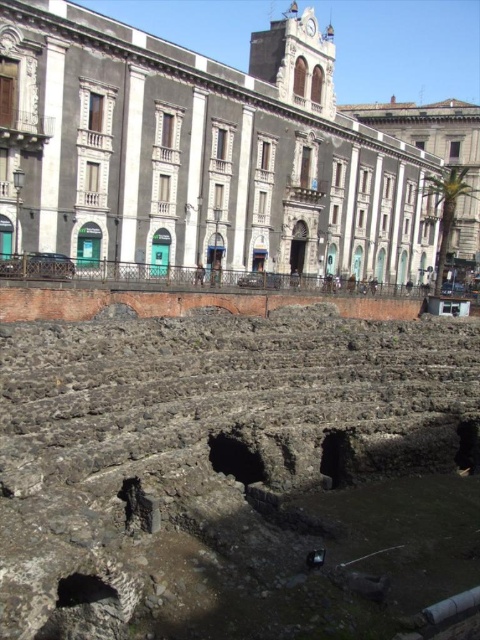
You are standing at the ancient amphitheater ruins in the foreground and want to reach the modern building in the background. There are two points marked on your map, point A at coordinates point A is point (446,595) and point B at coordinates point B is point (436,115). Which point should you head towards to get closer to the modern building?

Point B at coordinates point (436,115) is closer to the modern building because it is behind point A at coordinates point (446,595).

You are standing at the ancient amphitheater in the foreground of the image. You notice two points marked in the scene. The first point is at coordinate point (168,109) and the second is at point (231,432). If you want to walk towards the point that is closer to the modern clock tower building in the background, which coordinate should you head towards?

Point (168,109) is behind point (231,432). Therefore, to reach the modern clock tower building in the background, you should head towards point (231,432) since it is closer to the background structure.